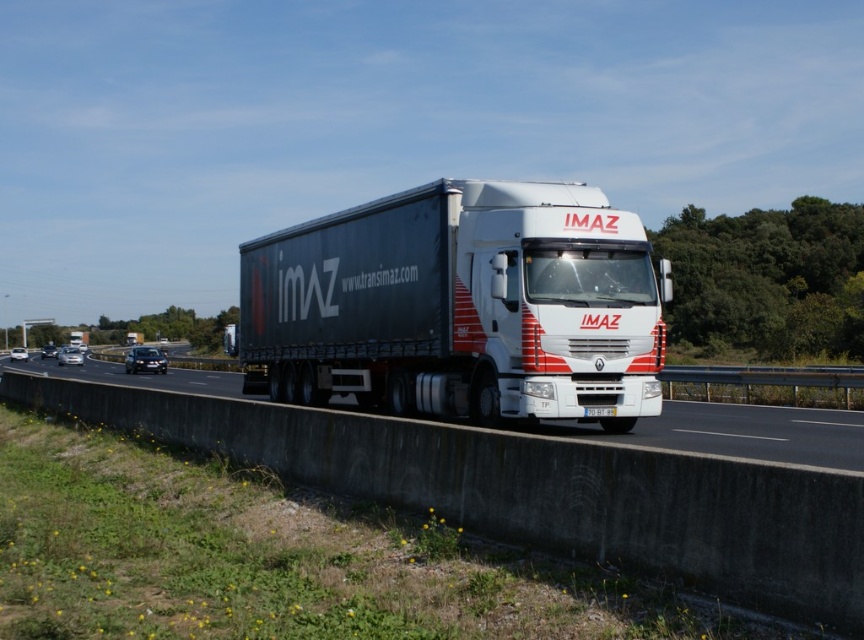
You are a driver in a car that is 2 meters long. You are currently driving on the highway and see the matte black trailer truck at center and the white glossy truck at center ahead of you. Can your car fit between them if you wanted to change lanes?

The distance between the matte black trailer truck at center and the white glossy truck at center is 4.71 meters. Since your car is only 2 meters long, there is enough space to safely maneuver between them during a lane change.

You are a photographer planning to take a photo of the matte black trailer truck at center and the white glossy truck at center. Which truck should you focus on if you want to capture the larger vehicle in your shot?

The white glossy truck at center is larger than the matte black trailer truck at center, so you should focus on the white glossy truck at center to capture the larger vehicle in your shot.

You are standing at the point marked by the coordinates (459, 307) in the image. Looking around, what object is directly in front of you?

The point at coordinates (459, 307) corresponds to the matte black trailer truck at center, so the matte black trailer truck at center is directly in front of you.